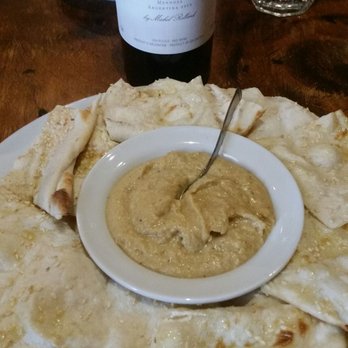
Locate an element on the screen. wine bottle is located at coordinates (201, 65).